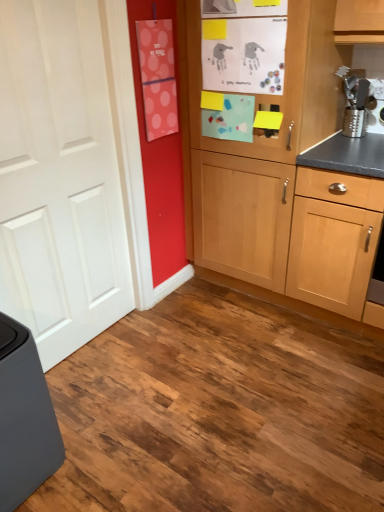
Question: Can you see metallic silver grater at upper right touching matte gray trash can at lower left?

Choices:
 (A) no
 (B) yes

Answer: (A)

Question: From a real-world perspective, does metallic silver grater at upper right stand above matte gray trash can at lower left?

Choices:
 (A) no
 (B) yes

Answer: (B)

Question: Is metallic silver grater at upper right looking in the opposite direction of matte gray trash can at lower left?

Choices:
 (A) no
 (B) yes

Answer: (A)

Question: Does metallic silver grater at upper right have a lesser width compared to matte gray trash can at lower left?

Choices:
 (A) no
 (B) yes

Answer: (B)

Question: Is metallic silver grater at upper right to the right of matte gray trash can at lower left from the viewer's perspective?

Choices:
 (A) yes
 (B) no

Answer: (A)

Question: Is metallic silver grater at upper right positioned far away from matte gray trash can at lower left?

Choices:
 (A) yes
 (B) no

Answer: (A)

Question: Can you confirm if white matte door at left is positioned to the left of light wood cabinet at center?

Choices:
 (A) yes
 (B) no

Answer: (A)

Question: From the image's perspective, is white matte door at left beneath light wood cabinet at center?

Choices:
 (A) yes
 (B) no

Answer: (A)

Question: Can you confirm if white matte door at left is shorter than light wood cabinet at center?

Choices:
 (A) no
 (B) yes

Answer: (B)

Question: From a real-world perspective, is white matte door at left physically above light wood cabinet at center?

Choices:
 (A) no
 (B) yes

Answer: (B)

Question: Is white matte door at left far from light wood cabinet at center?

Choices:
 (A) no
 (B) yes

Answer: (A)

Question: Is white matte door at left completely or partially outside of light wood cabinet at center?

Choices:
 (A) yes
 (B) no

Answer: (A)

Question: Does white matte door at left appear on the left side of matte gray trash can at lower left?

Choices:
 (A) no
 (B) yes

Answer: (A)